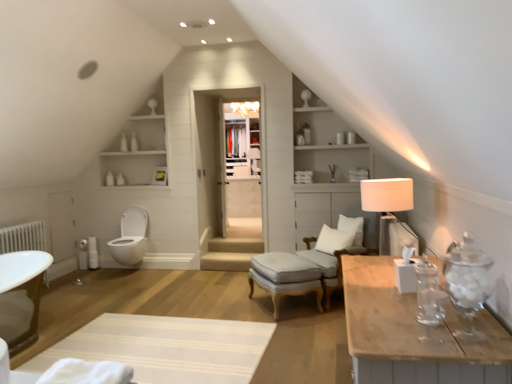
The height and width of the screenshot is (384, 512). In order to click on vacant region to the left of light gray fabric stool at center in this screenshot , I will do `click(234, 306)`.